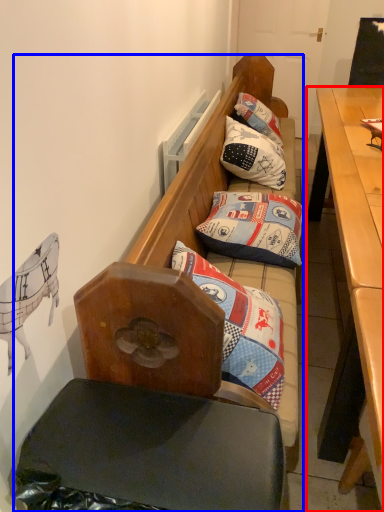
Question: Which of the following is the farthest to the observer, desk (highlighted by a red box) or studio couch (highlighted by a blue box)?

Choices:
 (A) desk
 (B) studio couch

Answer: (B)